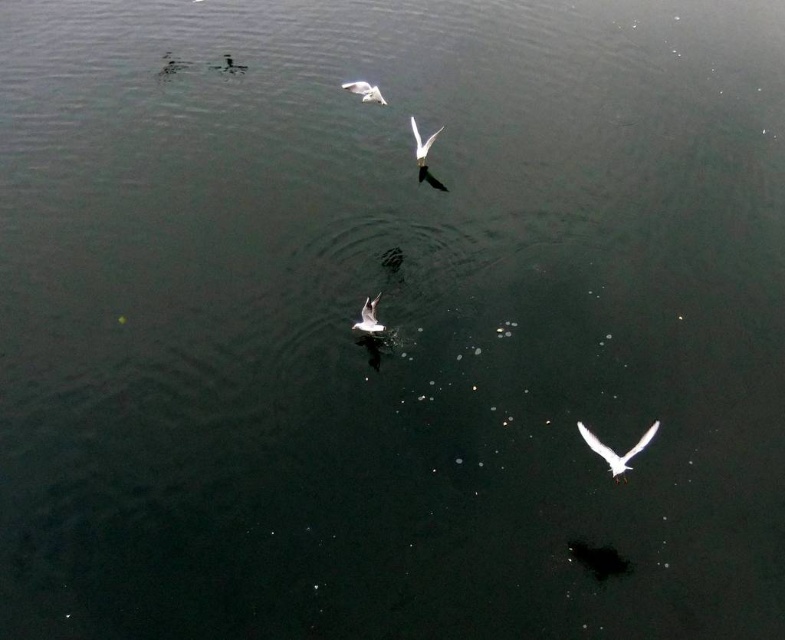
Does white matte bird at center have a lesser width compared to white matte bird at upper center?

Yes, white matte bird at center is thinner than white matte bird at upper center.

From the picture: Can you confirm if white matte bird at center is positioned above white matte bird at upper center?

Incorrect, white matte bird at center is not positioned above white matte bird at upper center.

Who is more forward, (378, 330) or (358, 84)?

Point (378, 330) is more forward.

This screenshot has width=785, height=640. I want to click on white matte bird at center, so click(367, 317).

Does white matte bird at center lie in front of white matte bird at upper left?

Yes, it is.

Does white matte bird at center have a greater height compared to white matte bird at upper left?

No.

Locate an element on the screen. white matte bird at center is located at coordinates (367, 317).

Who is lower down, white matte bird at upper center or white matte bird at upper left?

Positioned lower is white matte bird at upper center.

Which is more to the right, white matte bird at upper center or white matte bird at upper left?

white matte bird at upper center

Identify the location of white matte bird at upper center. The image size is (785, 640). (364, 92).